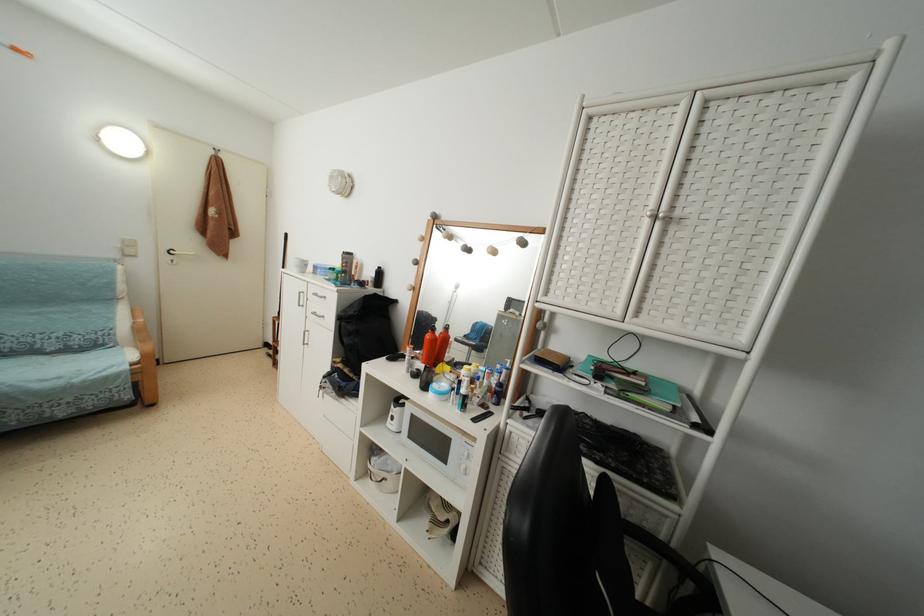
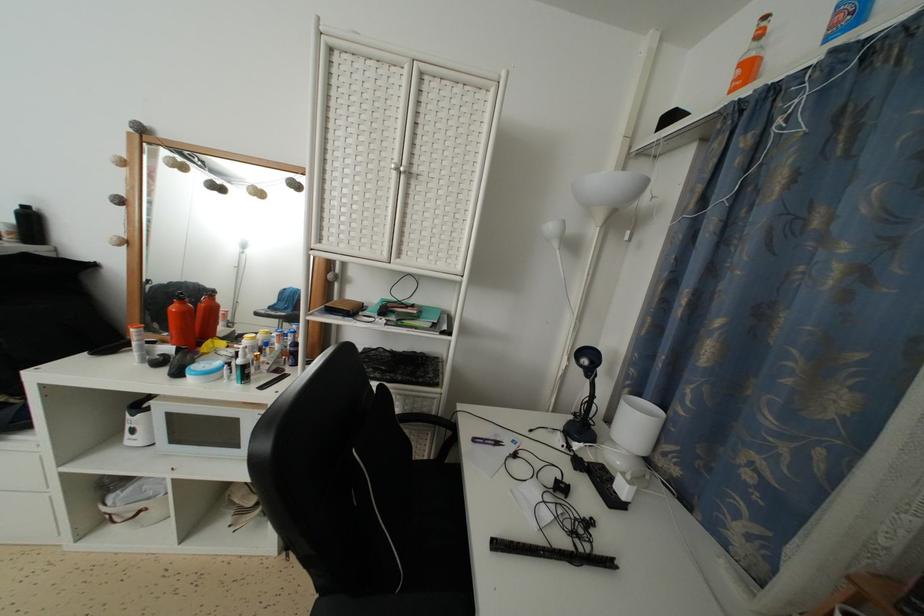
The point at (438,346) is marked in the first image. Where is the corresponding point in the second image?

(192, 318)